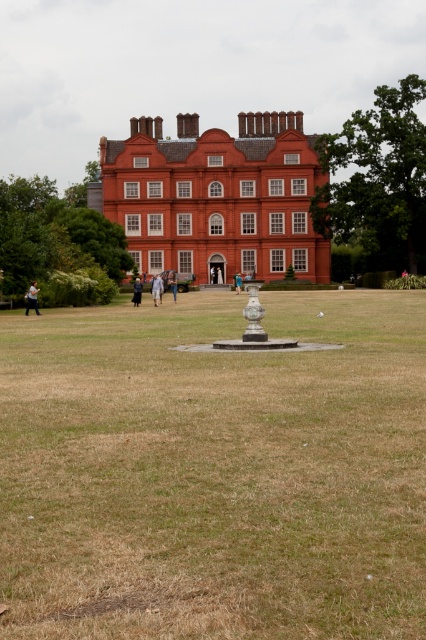
Does dark gray fabric coat at center appear on the left side of light brown leather jacket at center?

Correct, you'll find dark gray fabric coat at center to the left of light brown leather jacket at center.

Between dark gray fabric coat at center and light brown leather jacket at center, which one has more height?

Standing taller between the two is light brown leather jacket at center.

Between point (138, 292) and point (169, 284), which one is positioned behind?

The point (169, 284) is more distant.

At what (x,y) coordinates should I click in order to perform the action: click on dark gray fabric coat at center. Please return your answer as a coordinate pair (x, y). Looking at the image, I should click on (137, 291).

Does light blue denim jacket at center come in front of light brown leather jacket at center?

Yes, it is.

Is light blue denim jacket at center taller than light brown leather jacket at center?

Incorrect, light blue denim jacket at center's height is not larger of light brown leather jacket at center's.

Which is behind, point (158, 275) or point (170, 276)?

The point (158, 275) is behind.

Identify the location of light blue denim jacket at center. (157, 289).

Which is behind, point (75, 545) or point (34, 305)?

Positioned behind is point (34, 305).

Does brown grass at center appear on the left side of light brown fabric jacket at lower left?

Incorrect, brown grass at center is not on the left side of light brown fabric jacket at lower left.

This screenshot has height=640, width=426. What are the coordinates of `brown grass at center` in the screenshot? It's located at (213, 472).